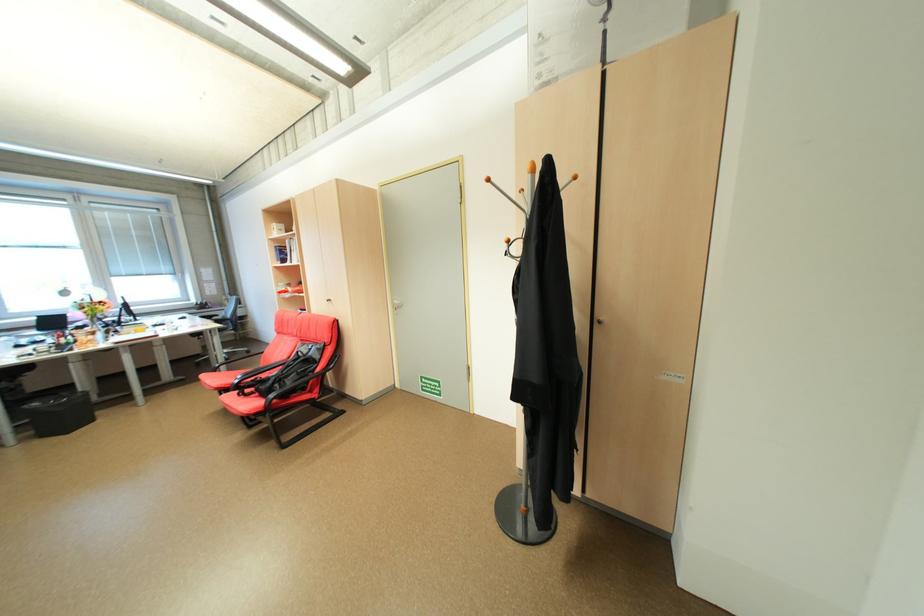
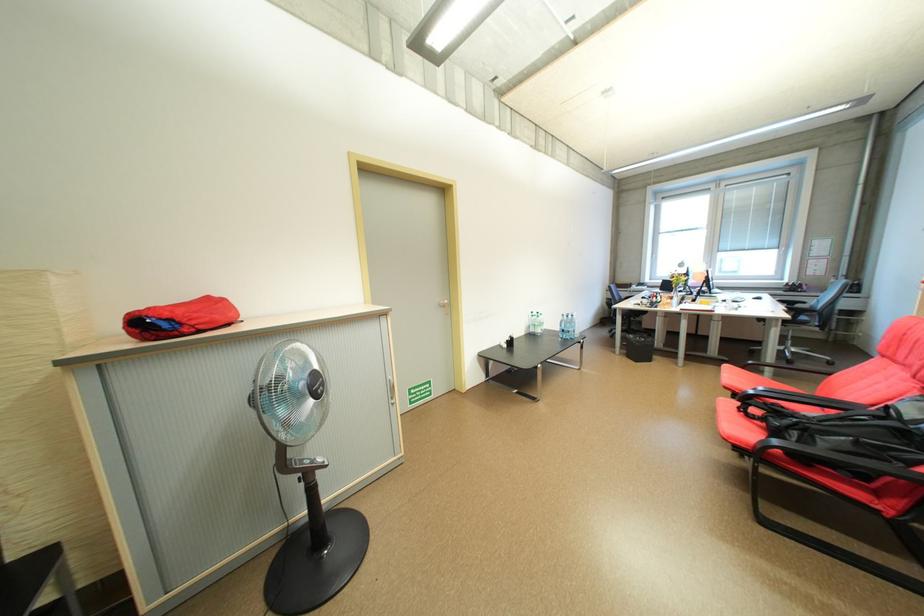
The point at [27,432] is marked in the first image. Where is the corresponding point in the second image?

(630, 349)